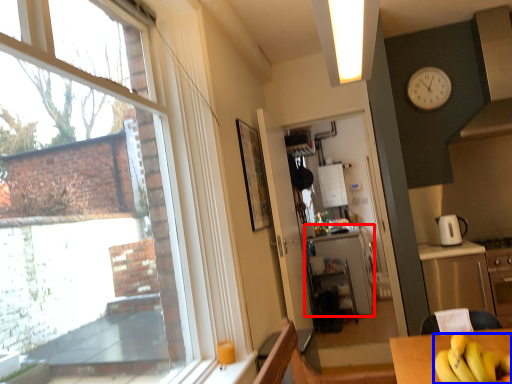
Question: Which point is closer to the camera, counter (highlighted by a red box) or banana (highlighted by a blue box)?

Choices:
 (A) counter
 (B) banana

Answer: (B)